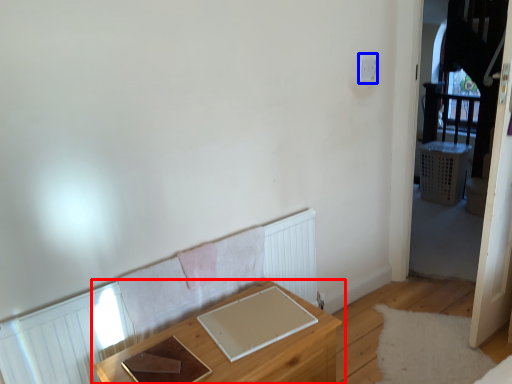
Question: Which object appears closest to the camera in this image, table (highlighted by a red box) or light switch (highlighted by a blue box)?

Choices:
 (A) table
 (B) light switch

Answer: (A)